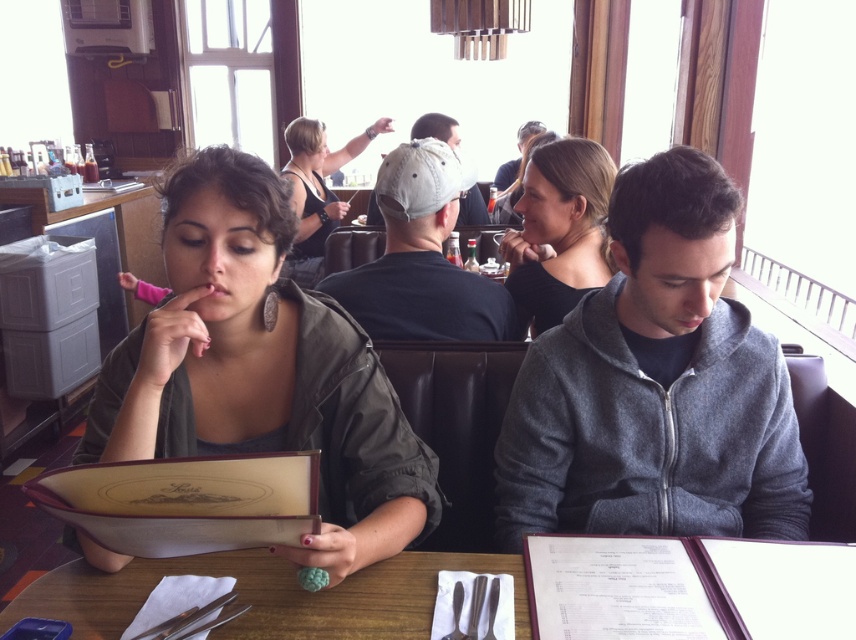
Is gray fleece jacket at right below white cap at center?

Yes.

Can you confirm if gray fleece jacket at right is positioned above white cap at center?

No, gray fleece jacket at right is not above white cap at center.

Does point (700, 435) come behind point (443, 308)?

No, (700, 435) is closer to viewer.

Where is `gray fleece jacket at right`? This screenshot has height=640, width=856. gray fleece jacket at right is located at coordinates (655, 385).

Which is more to the left, smooth black hair at center or black tank top at upper center?

black tank top at upper center is more to the left.

Who is positioned more to the right, smooth black hair at center or black tank top at upper center?

Positioned to the right is smooth black hair at center.

Which is in front, point (554, 211) or point (302, 150)?

Point (554, 211)

Image resolution: width=856 pixels, height=640 pixels. What are the coordinates of `smooth black hair at center` in the screenshot? It's located at (559, 230).

Between matte green jacket at left and matte black hair at upper center, which one has less height?

matte green jacket at left is shorter.

Is matte green jacket at left bigger than matte black hair at upper center?

Incorrect, matte green jacket at left is not larger than matte black hair at upper center.

Where is `matte green jacket at left`? The height and width of the screenshot is (640, 856). matte green jacket at left is located at coordinates [262, 369].

Locate an element on the screen. The image size is (856, 640). matte green jacket at left is located at coordinates (262, 369).